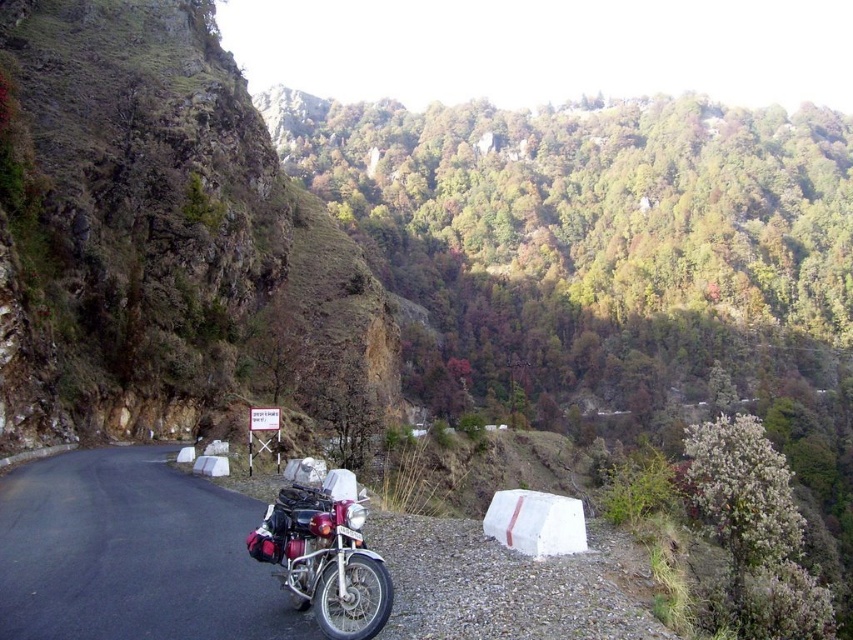
Between rugged stone cliff at left and metallic motorcycle at center, which one has more height?

Standing taller between the two is rugged stone cliff at left.

Between point (196, 150) and point (399, 577), which one is positioned behind?

Point (196, 150)

Locate an element on the screen. This screenshot has height=640, width=853. rugged stone cliff at left is located at coordinates pos(163,241).

Does rugged stone cliff at left appear under shiny chrome motorcycle at center?

No.

Is point (76, 256) positioned before point (367, 584)?

No, (76, 256) is behind (367, 584).

What do you see at coordinates (163, 241) in the screenshot?
I see `rugged stone cliff at left` at bounding box center [163, 241].

You are a GUI agent. You are given a task and a screenshot of the screen. Output one action in this format:
    pyautogui.click(x=<x>, y=<y>)
    Task: Click on the rugged stone cliff at left
    
    Given the screenshot: What is the action you would take?
    pyautogui.click(x=163, y=241)

Looking at this image, does metallic motorcycle at center come behind shiny chrome motorcycle at center?

No, it is in front of shiny chrome motorcycle at center.

Looking at this image, does metallic motorcycle at center have a greater height compared to shiny chrome motorcycle at center?

Incorrect, metallic motorcycle at center's height is not larger of shiny chrome motorcycle at center's.

Who is more forward, (222, 637) or (303, 529)?

Point (222, 637) is more forward.

Identify the location of metallic motorcycle at center. (132, 554).